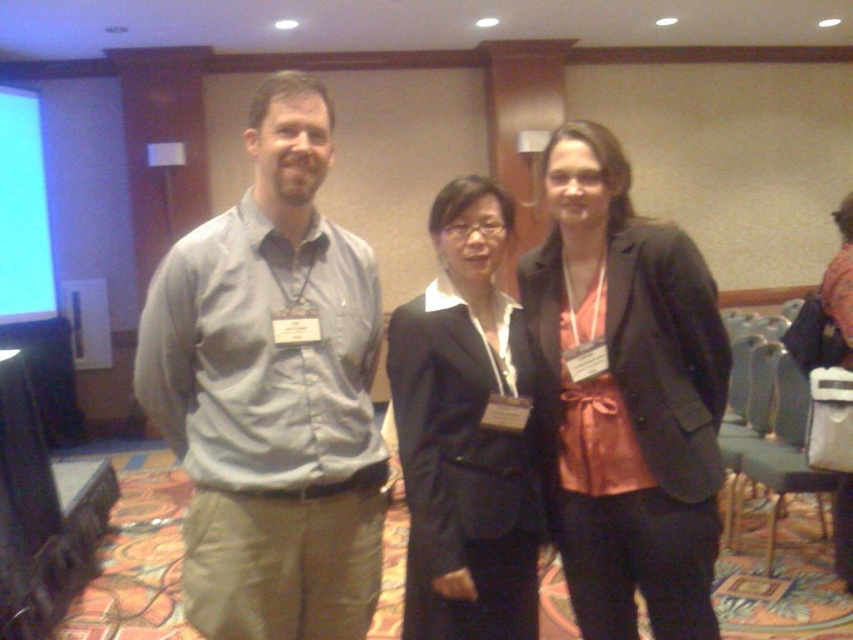
Question: Does gray cotton shirt at center appear on the right side of matte black blazer at center?

Choices:
 (A) no
 (B) yes

Answer: (A)

Question: Is matte black blazer at center thinner than black matte suit at center?

Choices:
 (A) no
 (B) yes

Answer: (A)

Question: Which point is closer to the camera?

Choices:
 (A) matte black blazer at center
 (B) black matte suit at center

Answer: (B)

Question: Can you confirm if gray cotton shirt at center is positioned above matte black blazer at center?

Choices:
 (A) no
 (B) yes

Answer: (B)

Question: Which point appears closest to the camera in this image?

Choices:
 (A) (473, 292)
 (B) (234, 474)

Answer: (B)

Question: Which of the following is the farthest from the observer?

Choices:
 (A) click(x=254, y=588)
 (B) click(x=520, y=404)

Answer: (B)